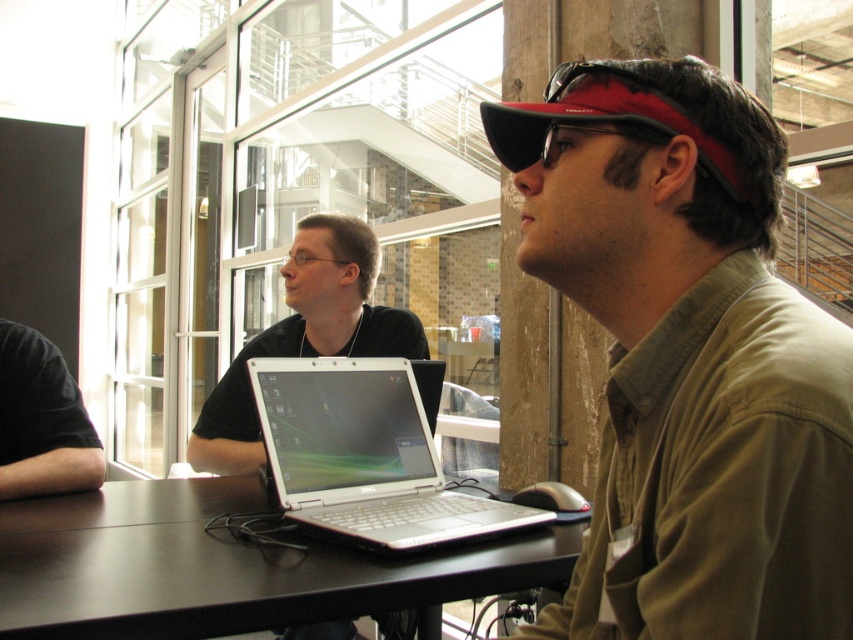
You are trying to determine the spatial relationship between the matte khaki shirt at center and the black matte baseball cap at upper right. Which object has a narrower width?

The matte khaki shirt at center is thinner than the black matte baseball cap at upper right, so the matte khaki shirt at center has a narrower width.

You are a person sitting at the dark brown wooden table at center. You want to reach the white glossy laptop at center. Is the laptop above or below you?

The dark brown wooden table at center is located below the white glossy laptop at center, so the laptop is above you.

Consider the image. You are standing in the room and want to place a 30 inch wide laptop on the dark brown wooden table at center. Can you fit the laptop on the table without it hanging over the edges?

The dark brown wooden table at center is 33.15 inches away from the camera, but this measurement refers to distance, not width. Since the table width isn not provided, we cannot determine if the laptop will fit.